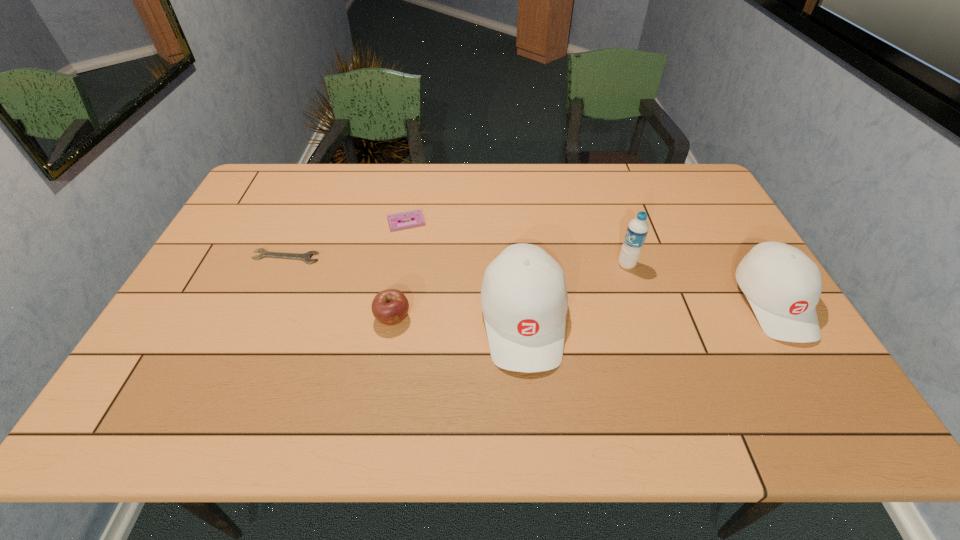
Locate an element on the screen. This screenshot has height=540, width=960. free region at the far edge of the desktop is located at coordinates (595, 197).

Where is `free space at the near edge of the desktop`? free space at the near edge of the desktop is located at coordinates coord(367,381).

The height and width of the screenshot is (540, 960). In order to click on vacant region at the left edge in this screenshot , I will do `click(214, 286)`.

Image resolution: width=960 pixels, height=540 pixels. What are the coordinates of `free space at the right edge` in the screenshot? It's located at (718, 236).

At what (x,y) coordinates should I click in order to perform the action: click on vacant space at the far left corner. Please return your answer as a coordinate pair (x, y). The image size is (960, 540). Looking at the image, I should click on (282, 171).

Find the location of a particular element. blank space at the near left corner is located at coordinates (141, 381).

Locate an element on the screen. free space between the fifth tallest object and the fifth object from left to right is located at coordinates (516, 243).

This screenshot has height=540, width=960. I want to click on free area in between the taller baseball cap and the third shortest object, so click(x=458, y=319).

The height and width of the screenshot is (540, 960). What are the coordinates of `free area in between the videotape and the third shortest object` in the screenshot? It's located at (399, 270).

Identify the location of free space between the fifth tallest object and the shorter baseball cap. The height and width of the screenshot is (540, 960). (589, 262).